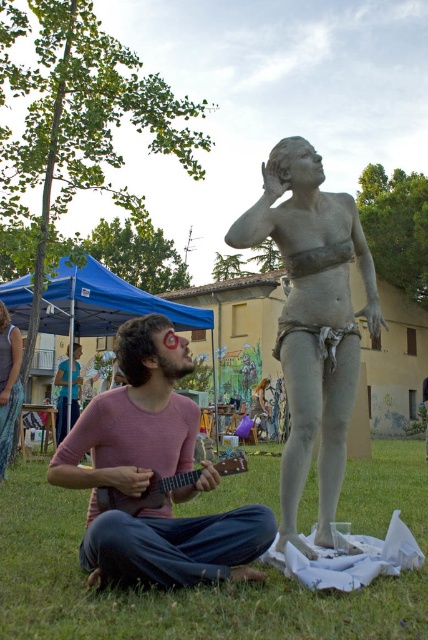
Question: Based on their relative distances, which object is farther from the wooden acoustic guitar at lower center?

Choices:
 (A) matte clay statue at center
 (B) pink cotton shirt at center

Answer: (A)

Question: Does pink cotton shirt at center have a greater width compared to wooden acoustic guitar at lower center?

Choices:
 (A) yes
 (B) no

Answer: (A)

Question: Does matte clay statue at center have a greater width compared to wooden acoustic guitar at lower center?

Choices:
 (A) yes
 (B) no

Answer: (A)

Question: Which object appears farthest from the camera in this image?

Choices:
 (A) wooden acoustic guitar at lower center
 (B) green grass at lower center
 (C) matte clay statue at center

Answer: (C)

Question: Where is matte clay statue at center located in relation to wooden acoustic guitar at lower center in the image?

Choices:
 (A) left
 (B) right

Answer: (B)

Question: Which of these objects is positioned farthest from the matte clay statue at center?

Choices:
 (A) green grass at lower center
 (B) pink cotton shirt at center
 (C) wooden acoustic guitar at lower center

Answer: (A)